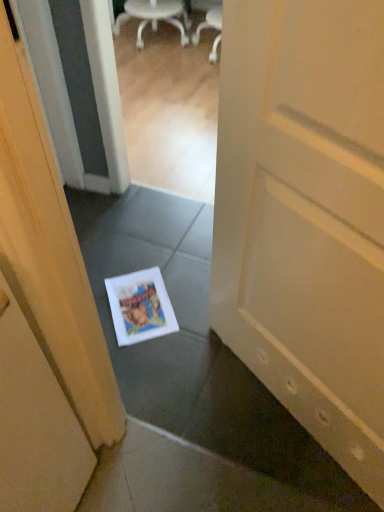
Question: Is white matte door at center wider or thinner than white plastic chair at upper center?

Choices:
 (A) thin
 (B) wide

Answer: (A)

Question: Relative to white plastic chair at upper center, is white matte door at center in front or behind?

Choices:
 (A) behind
 (B) front

Answer: (B)

Question: Which is farther from the white plastic chair at upper center?

Choices:
 (A) white matte door at center
 (B) white matte magazine at center

Answer: (A)

Question: Which of these objects is positioned farthest from the white matte door at center?

Choices:
 (A) white matte magazine at center
 (B) white plastic chair at upper center

Answer: (B)